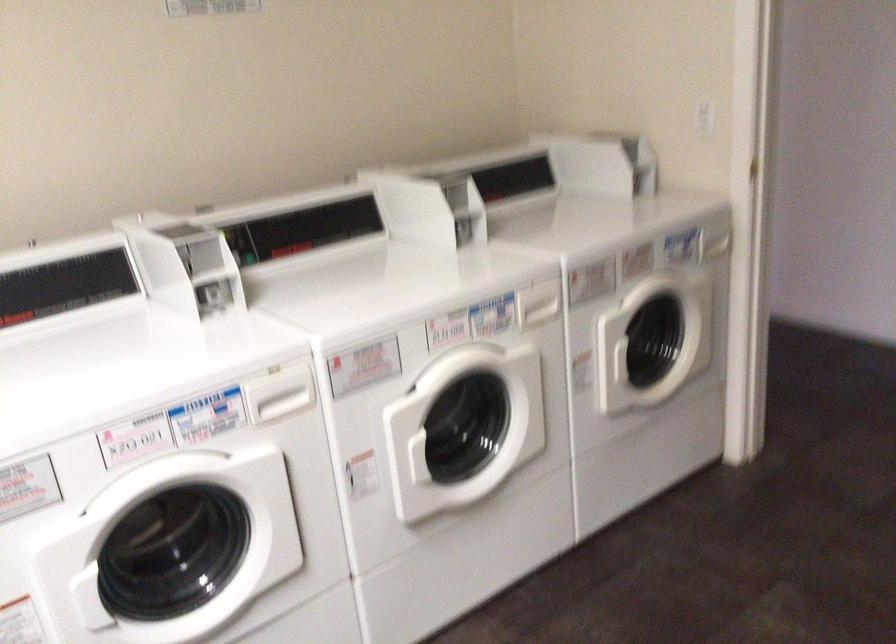
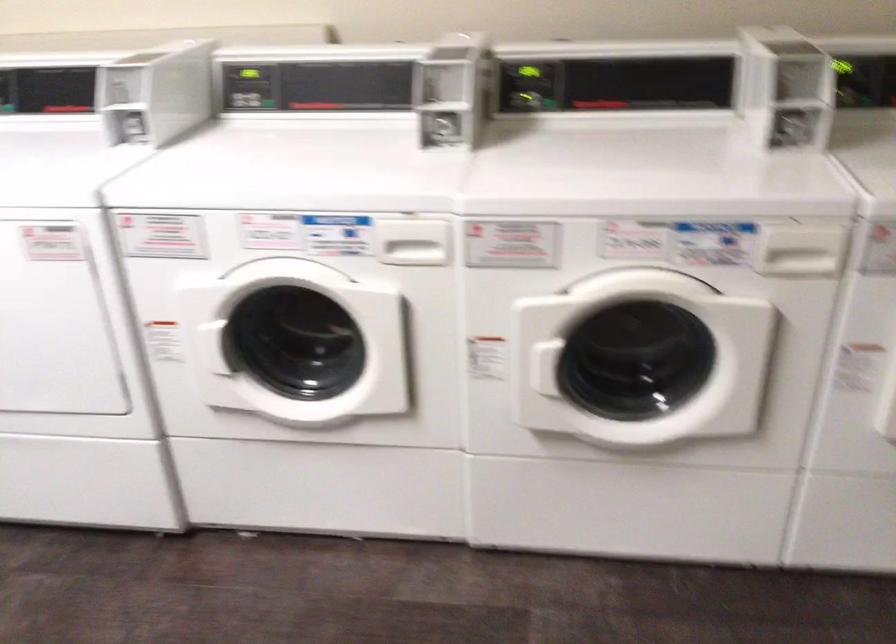
Find the pixel in the second image that matches the point at 455,196 in the first image.

(794, 80)